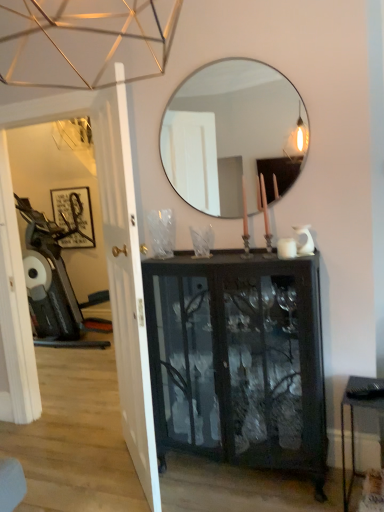
This screenshot has width=384, height=512. Find the location of `free space to the left of metallic black table at lower right`. free space to the left of metallic black table at lower right is located at coordinates (318, 495).